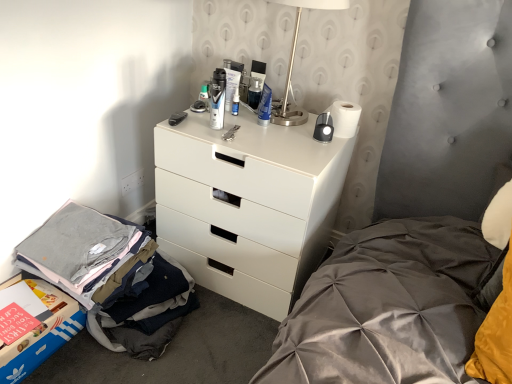
At what (x,y) coordinates should I click in order to perform the action: click on free space between white matte toilet paper at upper right and matte black shaving cream can at center, acting as the 4th toiletry starting from the right. Please return your answer as a coordinate pair (x, y). Looking at the image, I should click on (273, 131).